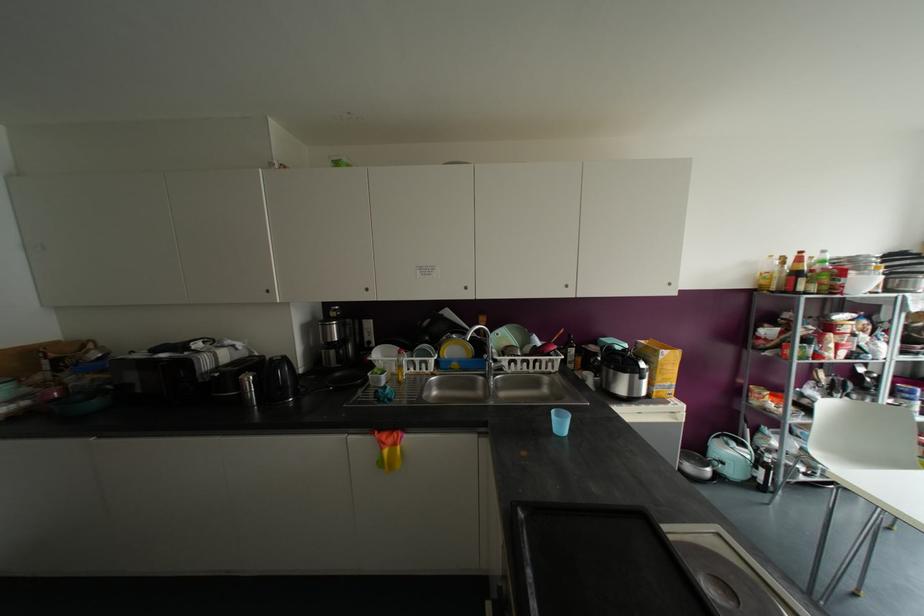
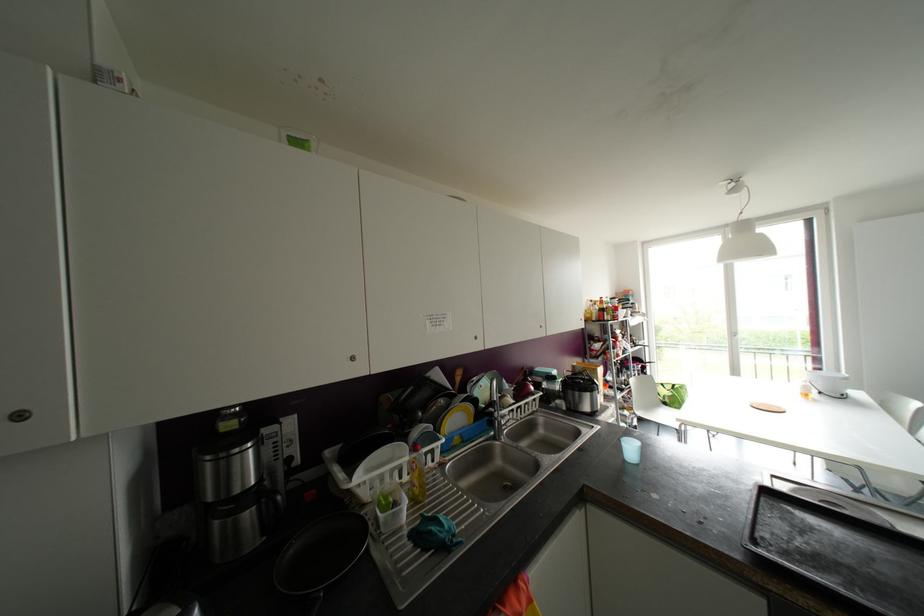
In the second image, find the point that corresponds to (266,291) in the first image.

(19, 416)